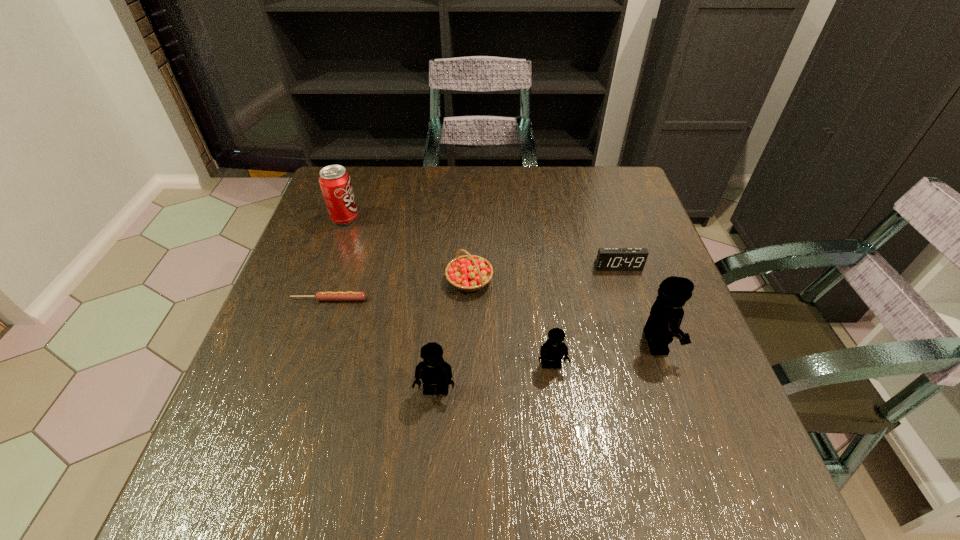
Find the location of a particular element. free space located 0.060m on the front-facing side of the leftmost Lego is located at coordinates (432, 434).

The height and width of the screenshot is (540, 960). Find the location of `free space located 0.080m on the back of the strawberry`. free space located 0.080m on the back of the strawberry is located at coordinates (470, 243).

The height and width of the screenshot is (540, 960). In order to click on blank area located 0.070m on the right of the shortest object in this screenshot , I will do `click(398, 299)`.

What are the coordinates of `vacant space situated on the front of the soda` in the screenshot? It's located at (305, 329).

Find the location of `free point located 0.280m on the front-facing side of the sixth tallest object`. free point located 0.280m on the front-facing side of the sixth tallest object is located at coordinates (652, 373).

You are a GUI agent. You are given a task and a screenshot of the screen. Output one action in this format:
    pyautogui.click(x=<x>, y=<y>)
    Task: Click on the object that is at the far edge
    
    Given the screenshot: What is the action you would take?
    pyautogui.click(x=335, y=182)

The image size is (960, 540). What are the coordinates of `object present at the near edge` in the screenshot? It's located at (433, 370).

Identify the location of sausage present at the left edge. This screenshot has width=960, height=540. (320, 296).

Identify the location of soda positioned at the left edge. (335, 182).

Locate an element on the screen. Lego present at the right edge is located at coordinates (666, 314).